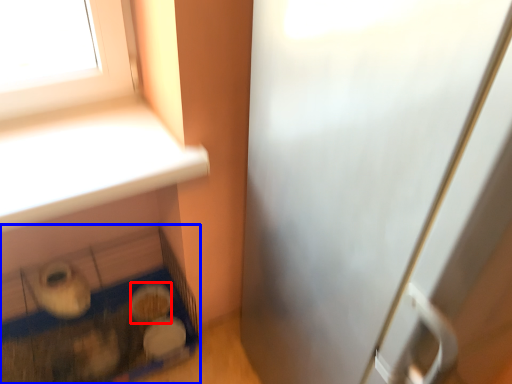
Question: Which of the following is the farthest to the observer, food (highlighted by a red box) or bird cage (highlighted by a blue box)?

Choices:
 (A) food
 (B) bird cage

Answer: (A)